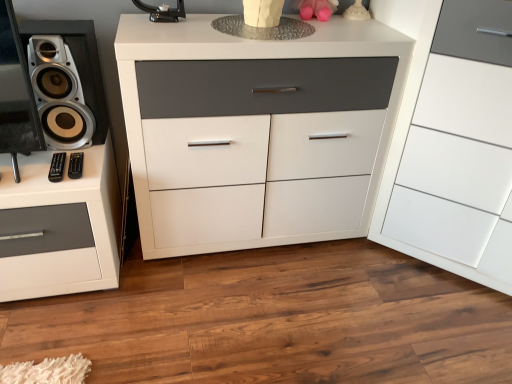
Question: Does white glossy speaker at left appear on the left side of pink rubber toy at upper center?

Choices:
 (A) no
 (B) yes

Answer: (B)

Question: Is white glossy speaker at left oriented away from pink rubber toy at upper center?

Choices:
 (A) no
 (B) yes

Answer: (A)

Question: From the image's perspective, is white glossy speaker at left on top of pink rubber toy at upper center?

Choices:
 (A) no
 (B) yes

Answer: (A)

Question: Is white glossy speaker at left positioned behind pink rubber toy at upper center?

Choices:
 (A) yes
 (B) no

Answer: (B)

Question: Is white glossy speaker at left not within pink rubber toy at upper center?

Choices:
 (A) no
 (B) yes

Answer: (B)

Question: Is white glossy speaker at left facing towards pink rubber toy at upper center?

Choices:
 (A) yes
 (B) no

Answer: (B)

Question: Is black plastic remote at lower left aimed at pink rubber toy at upper center?

Choices:
 (A) no
 (B) yes

Answer: (A)

Question: From the image's perspective, is black plastic remote at lower left located beneath pink rubber toy at upper center?

Choices:
 (A) yes
 (B) no

Answer: (A)

Question: From the image's perspective, is black plastic remote at lower left located above pink rubber toy at upper center?

Choices:
 (A) yes
 (B) no

Answer: (B)

Question: Is black plastic remote at lower left thinner than pink rubber toy at upper center?

Choices:
 (A) yes
 (B) no

Answer: (B)

Question: Considering the relative sizes of black plastic remote at lower left and pink rubber toy at upper center in the image provided, is black plastic remote at lower left bigger than pink rubber toy at upper center?

Choices:
 (A) no
 (B) yes

Answer: (A)

Question: Is black plastic remote at lower left positioned far away from pink rubber toy at upper center?

Choices:
 (A) yes
 (B) no

Answer: (A)

Question: Is pink rubber toy at upper center aimed at white glossy drawer at center, which appears as the 2th chest of drawers when viewed from the left?

Choices:
 (A) no
 (B) yes

Answer: (A)